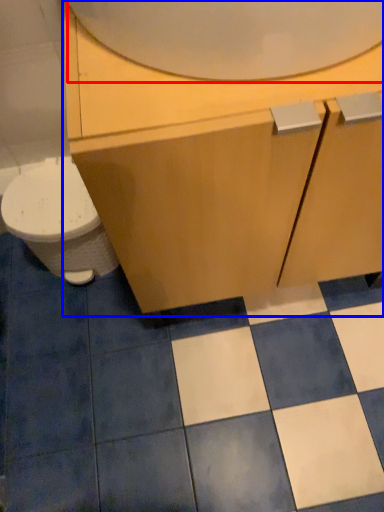
Question: Among these objects, which one is nearest to the camera, mirror (highlighted by a red box) or bathroom cabinet (highlighted by a blue box)?

Choices:
 (A) mirror
 (B) bathroom cabinet

Answer: (A)